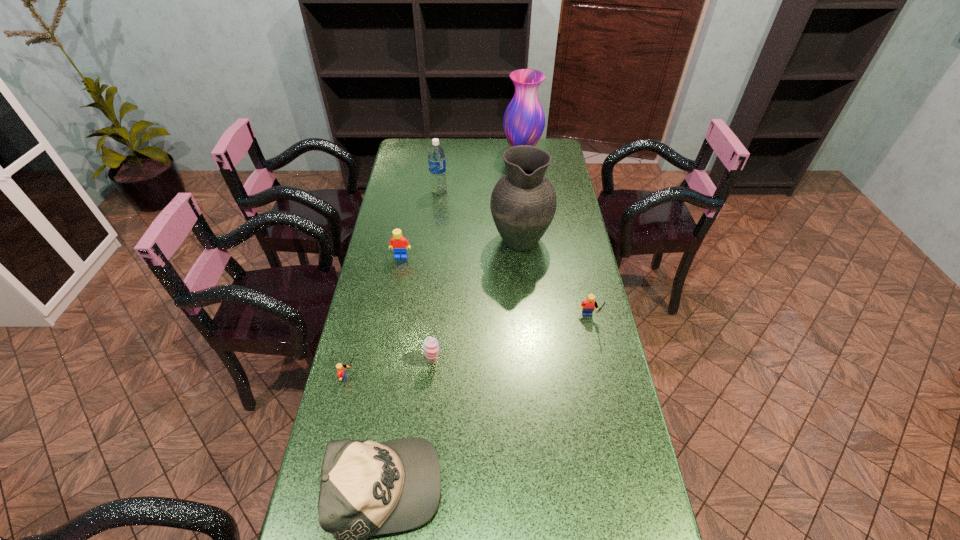
Identify the location of free space that satisfies the following two spatial constraints: 1. on the front side of the third nearest object; 2. on the right side of the seventh nearest object. (420, 362).

At what (x,y) coordinates should I click in order to perform the action: click on vacant space that satisfies the following two spatial constraints: 1. on the face of the third nearest object; 2. on the left side of the farthest Lego. Please return your answer as a coordinate pair (x, y). The width and height of the screenshot is (960, 540). Looking at the image, I should click on (382, 362).

Locate an element on the screen. vacant space that satisfies the following two spatial constraints: 1. on the face of the farthest Lego; 2. on the right side of the sherbert is located at coordinates (382, 362).